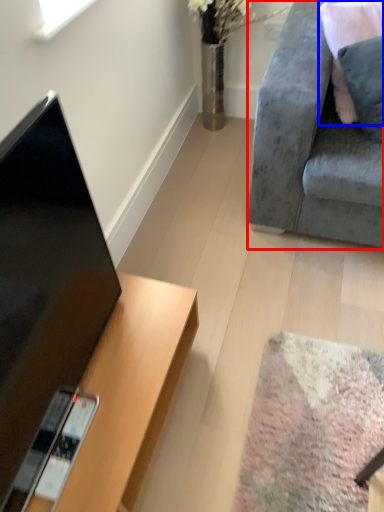
Question: Which object is further to the camera taking this photo, studio couch (highlighted by a red box) or pillow (highlighted by a blue box)?

Choices:
 (A) studio couch
 (B) pillow

Answer: (B)